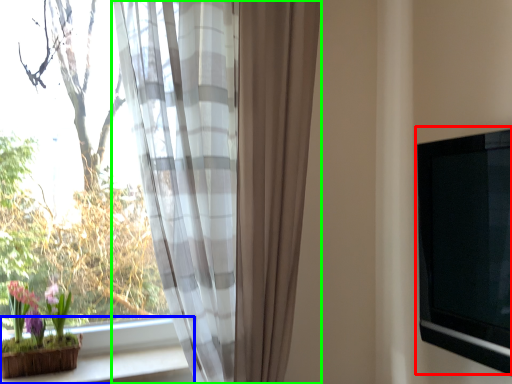
Question: Which object is positioned farthest from window screen (highlighted by a red box)? Select from window sill (highlighted by a blue box) and curtain (highlighted by a green box).

Choices:
 (A) window sill
 (B) curtain

Answer: (A)